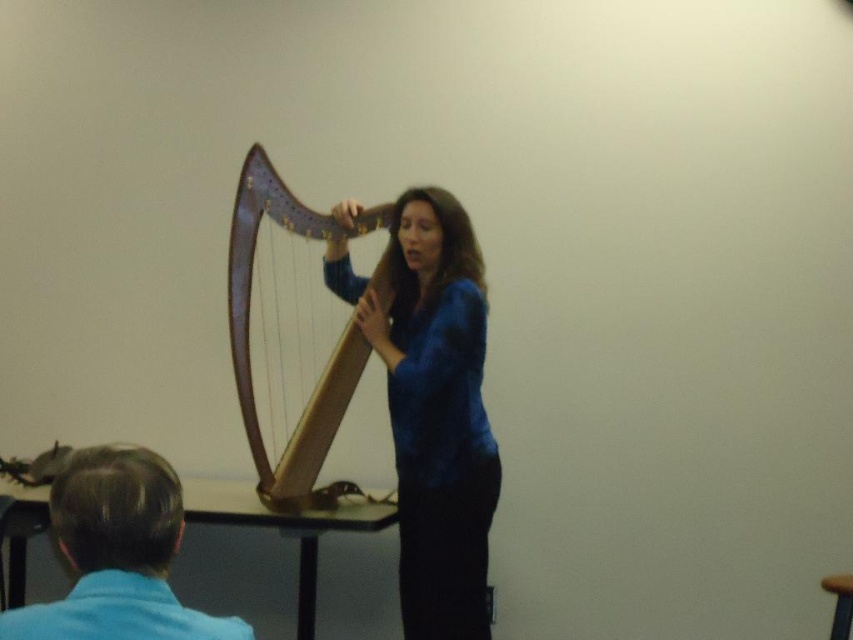
Question: Which point is closer to the camera?

Choices:
 (A) velvet blue dress at center
 (B) brown wood stool at lower right

Answer: (B)

Question: Which point is closer to the camera?

Choices:
 (A) velvet blue dress at center
 (B) brown wood stool at lower right
 (C) wooden harp at center

Answer: (B)

Question: Among these points, which one is nearest to the camera?

Choices:
 (A) (846, 612)
 (B) (236, 378)
 (C) (126, 449)

Answer: (C)

Question: Can you confirm if wooden harp at center is positioned below brown wood stool at lower right?

Choices:
 (A) no
 (B) yes

Answer: (A)

Question: Observing the image, what is the correct spatial positioning of velvet blue dress at center in reference to brown wood stool at lower right?

Choices:
 (A) right
 (B) left

Answer: (B)

Question: Observing the image, what is the correct spatial positioning of wooden harp at center in reference to blue fabric shirt at lower left?

Choices:
 (A) below
 (B) above

Answer: (B)